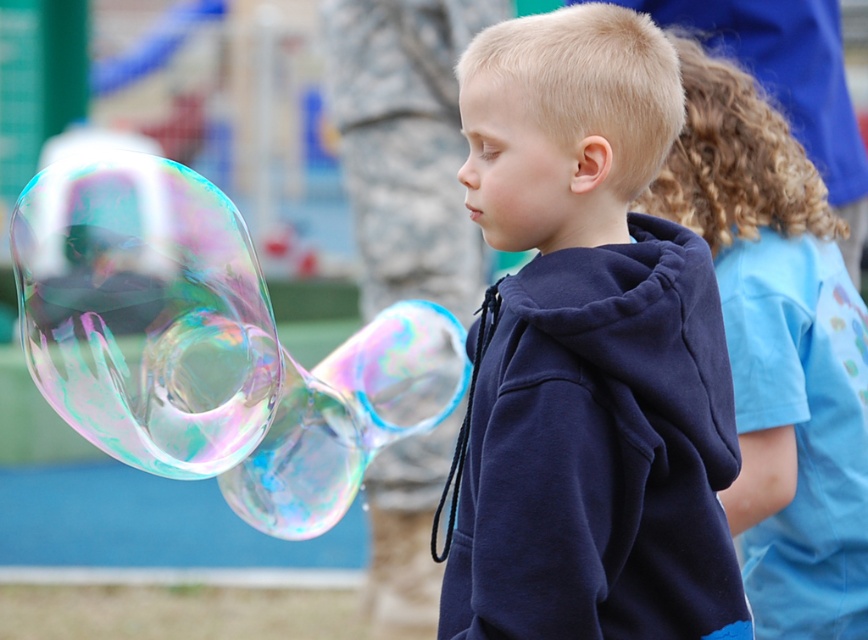
You are standing at the center of the image and want to pop the transparent iridescent bubble at left. In which direction should you move to reach it?

The transparent iridescent bubble at left is located at point 0.489 on the x axis and 0.168 on the y axis. Since you are at the center, you should move to the left and down to reach it.

You are a scientist observing the two groups of bubbles in the image. The first group is a single transparent iridescent bubble at left, and the second group is multiple transparent iridescent bubbles at left. Which group of bubbles is more likely to pop first?

The transparent iridescent bubble at left is more likely to pop first because it is thinner than the transparent iridescent bubbles at left.

You are standing in the scene and want to hand the navy blue hoodie at center to a friend who is 1.8 meters tall. Can you reach the hoodie without moving closer?

The navy blue hoodie at center is 1.99 meters away from the viewer. Since the friend is 1.8 meters tall, the distance is slightly more than their height, so you cannot reach the hoodie without moving closer.